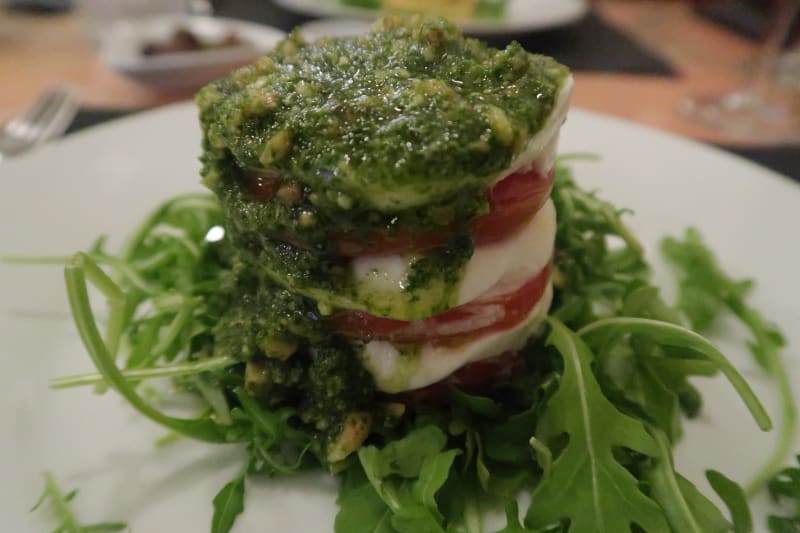
Find the location of a particular element. small bowl of probably nuts is located at coordinates pyautogui.click(x=122, y=41).